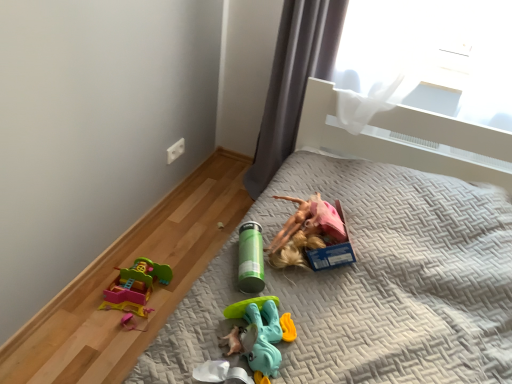
Question: From a real-world perspective, is translucent plastic toy at center, acting as the first toy starting from the bottom, positioned under green matte thermos at center, arranged as the first toy when viewed from the top, based on gravity?

Choices:
 (A) no
 (B) yes

Answer: (B)

Question: From a real-world perspective, is translucent plastic toy at center, acting as the second toy starting from the top, over green matte thermos at center, the first toy viewed from the back?

Choices:
 (A) yes
 (B) no

Answer: (B)

Question: Is translucent plastic toy at center, which ranks as the first toy in front-to-back order, aimed at green matte thermos at center, the first toy viewed from the back?

Choices:
 (A) yes
 (B) no

Answer: (B)

Question: Is translucent plastic toy at center, acting as the first toy starting from the bottom, positioned before green matte thermos at center, the second toy when ordered from front to back?

Choices:
 (A) yes
 (B) no

Answer: (A)

Question: From the image's perspective, is translucent plastic toy at center, acting as the first toy starting from the bottom, under green matte thermos at center, the second toy when ordered from front to back?

Choices:
 (A) no
 (B) yes

Answer: (B)

Question: Is translucent plastic toy at center, acting as the first toy starting from the bottom, to the right of green matte thermos at center, arranged as the first toy when viewed from the top, from the viewer's perspective?

Choices:
 (A) no
 (B) yes

Answer: (A)

Question: Is green matte thermos at center, which is counted as the 2th toy, starting from the bottom, located within gray quilted bed at center?

Choices:
 (A) no
 (B) yes

Answer: (B)

Question: From a real-world perspective, is gray quilted bed at center on top of green matte thermos at center, which is counted as the 2th toy, starting from the bottom?

Choices:
 (A) no
 (B) yes

Answer: (A)

Question: Considering the relative sizes of gray quilted bed at center and green matte thermos at center, arranged as the first toy when viewed from the top, in the image provided, is gray quilted bed at center thinner than green matte thermos at center, arranged as the first toy when viewed from the top,?

Choices:
 (A) no
 (B) yes

Answer: (A)

Question: Is the surface of gray quilted bed at center in direct contact with green matte thermos at center, which is counted as the 2th toy, starting from the bottom?

Choices:
 (A) yes
 (B) no

Answer: (B)

Question: Is gray quilted bed at center positioned behind green matte thermos at center, the first toy viewed from the back?

Choices:
 (A) no
 (B) yes

Answer: (A)

Question: Does gray quilted bed at center appear on the right side of green matte thermos at center, the second toy when ordered from front to back?

Choices:
 (A) no
 (B) yes

Answer: (B)

Question: Is the depth of gray fabric curtain at upper right less than that of translucent plastic toy at center, acting as the first toy starting from the bottom?

Choices:
 (A) yes
 (B) no

Answer: (B)